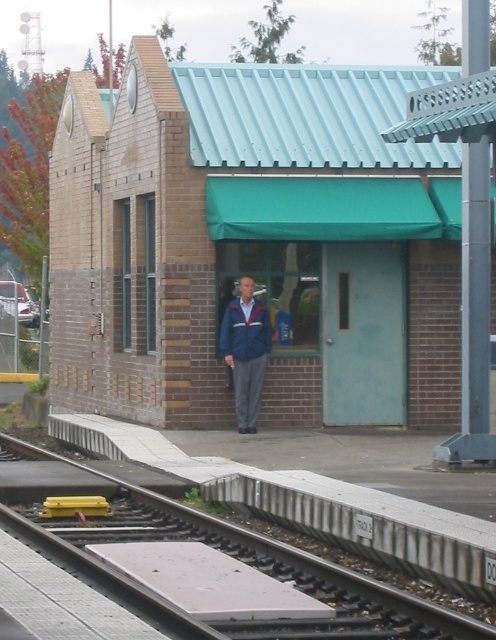
Which of these two, brown brick building at center or blue fabric jacket at center, stands shorter?

Standing shorter between the two is brown brick building at center.

Who is more forward, (262, 282) or (243, 406)?

Point (243, 406) is in front.

Is point (215, 81) farther from viewer compared to point (241, 355)?

Yes.

In order to click on brown brick building at center in this screenshot , I will do `click(253, 243)`.

Which is more to the right, metallic gray train track at lower left or blue fabric jacket at center?

From the viewer's perspective, blue fabric jacket at center appears more on the right side.

The width and height of the screenshot is (496, 640). Identify the location of metallic gray train track at lower left. (267, 568).

Is brown brick building at center below metallic gray train track at lower left?

No, brown brick building at center is not below metallic gray train track at lower left.

Is point (367, 369) farther from viewer compared to point (74, 525)?

Yes, it is behind point (74, 525).

Find the location of `brown brick building at center`. brown brick building at center is located at coordinates (253, 243).